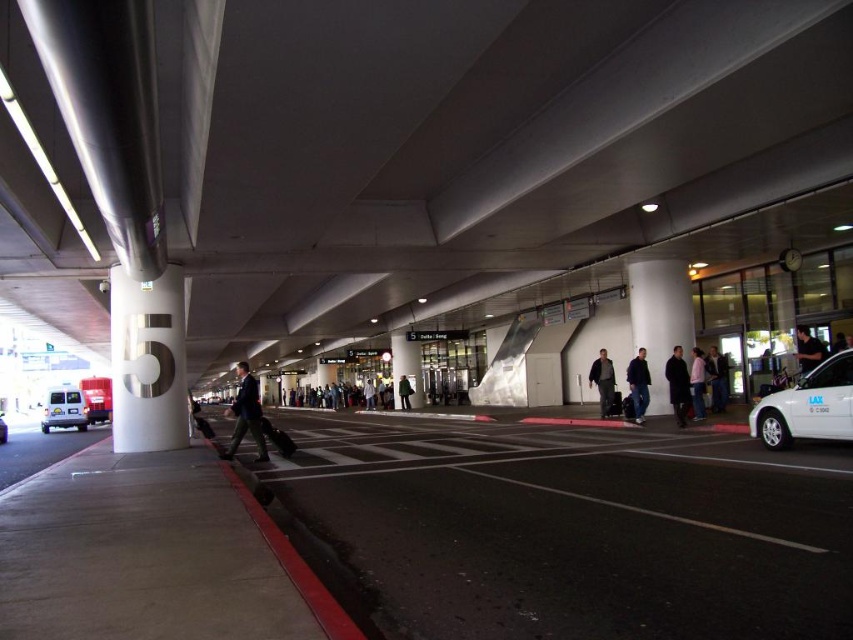
Does light blue jeans at center have a lesser height compared to black leather jacket at center?

In fact, light blue jeans at center may be taller than black leather jacket at center.

Which of these two, light blue jeans at center or black leather jacket at center, stands shorter?

Standing shorter between the two is black leather jacket at center.

Is point (714, 404) farther from camera compared to point (805, 349)?

Yes, it is.

You are a GUI agent. You are given a task and a screenshot of the screen. Output one action in this format:
    pyautogui.click(x=<x>, y=<y>)
    Task: Click on the light blue jeans at center
    The height and width of the screenshot is (640, 853).
    Given the screenshot: What is the action you would take?
    pyautogui.click(x=717, y=378)

Does white glossy taxi at right have a lesser width compared to dark brown coat at center?

No, white glossy taxi at right is not thinner than dark brown coat at center.

Which is below, white glossy taxi at right or dark brown coat at center?

dark brown coat at center is below.

Does point (827, 412) lie in front of point (677, 412)?

Yes, it is.

The width and height of the screenshot is (853, 640). I want to click on white glossy taxi at right, so [808, 406].

Who is higher up, white smooth pillar at center or light blue jeans at center?

white smooth pillar at center

Does white smooth pillar at center have a greater width compared to light blue jeans at center?

Indeed, white smooth pillar at center has a greater width compared to light blue jeans at center.

Where is `white smooth pillar at center`? The width and height of the screenshot is (853, 640). white smooth pillar at center is located at coordinates (660, 317).